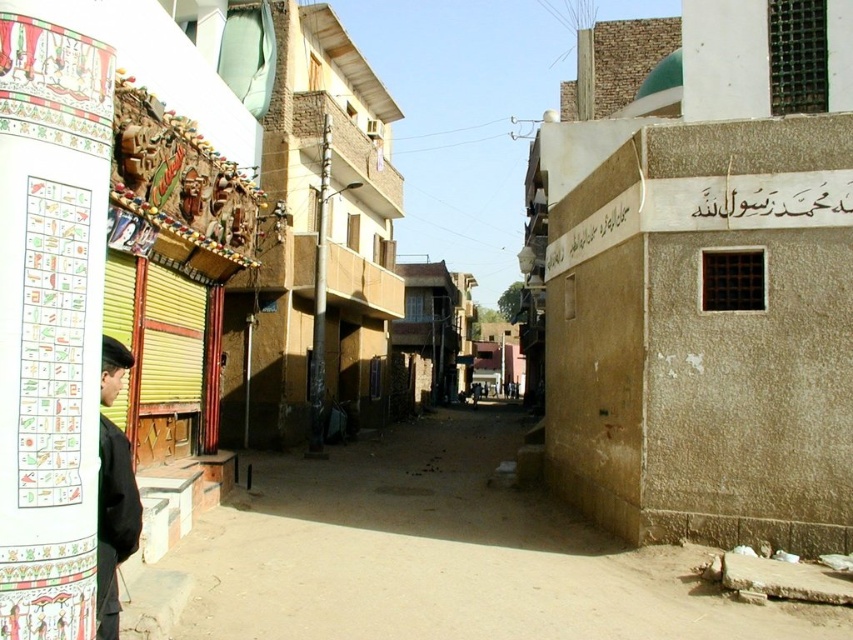
Question: Is black matte jacket at left thinner than black stone sign at upper right?

Choices:
 (A) no
 (B) yes

Answer: (B)

Question: Which object is farther from the camera taking this photo?

Choices:
 (A) dull concrete alley at center
 (B) black matte jacket at left
 (C) white stone sign at upper right

Answer: (C)

Question: Which of these objects is positioned farthest from the dull concrete alley at center?

Choices:
 (A) black stone sign at upper right
 (B) black matte jacket at left
 (C) white stone sign at upper right

Answer: (B)

Question: Which object is positioned closest to the dull concrete alley at center?

Choices:
 (A) black matte jacket at left
 (B) white stone sign at upper right

Answer: (B)

Question: Does dull concrete alley at center appear on the right side of black matte jacket at left?

Choices:
 (A) yes
 (B) no

Answer: (A)

Question: Can you confirm if black matte jacket at left is bigger than black stone sign at upper right?

Choices:
 (A) no
 (B) yes

Answer: (A)